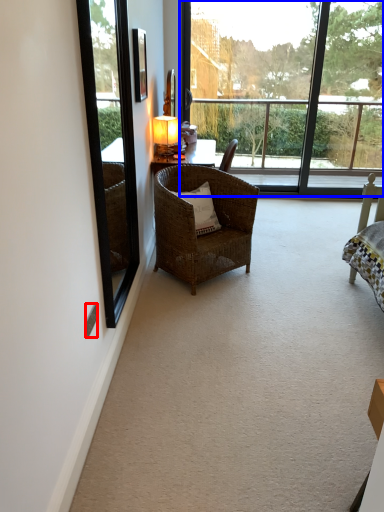
Question: Which point is further to the camera, power outlet (highlighted by a red box) or window (highlighted by a blue box)?

Choices:
 (A) power outlet
 (B) window

Answer: (B)